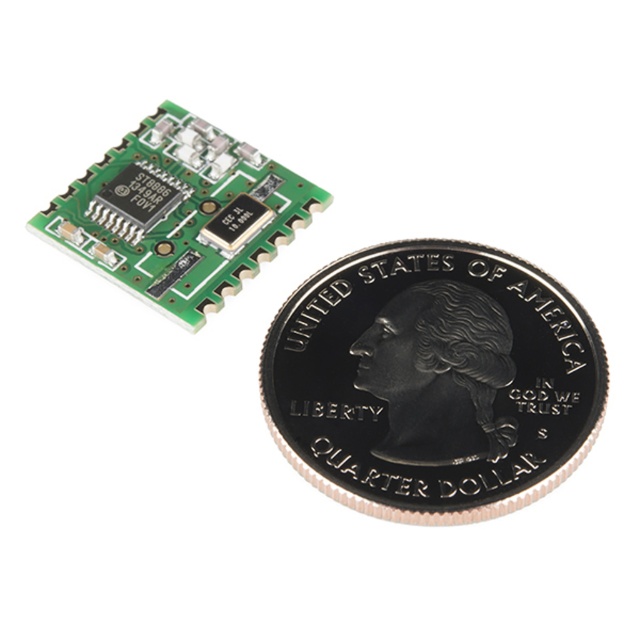
Does point (547, 429) lie behind point (72, 212)?

No, (547, 429) is in front of (72, 212).

Between point (515, 508) and point (193, 116), which one is positioned behind?

The point (193, 116) is behind.

Identify the location of silver/black metallic quarter at center. This screenshot has height=640, width=640. (433, 381).